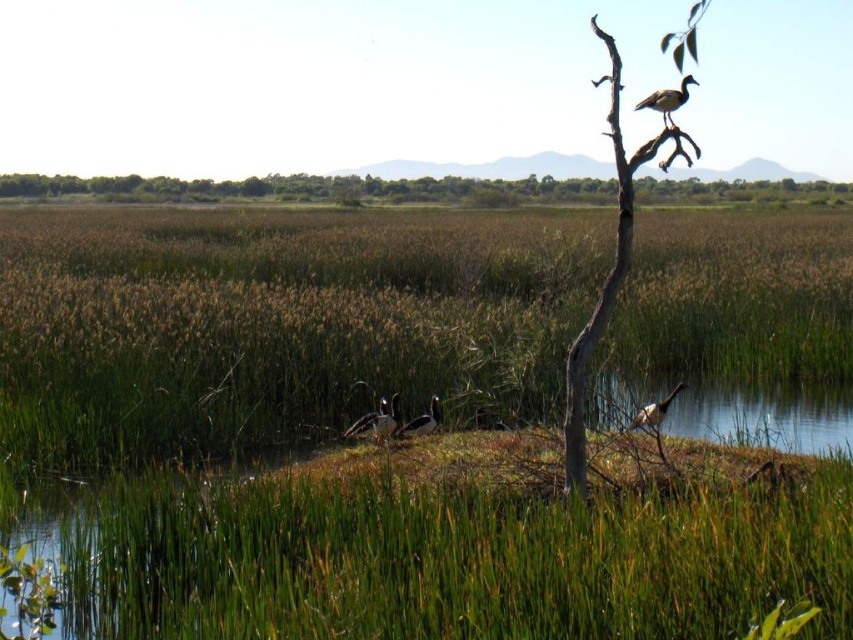
Consider the image. You are a drone operator trying to capture a photo of the green grassy mound at center. The drone is currently at position coordinates of point 0.7, 0.5. To ensure the mound is centered in the photo, should you move the drone north or south? Please provide your answer based on the 2D coordinates provided.

The green grassy mound at center is located at point (x=463, y=552). Since the drone is at (x=426, y=448), which is to the west and slightly south of the mound, you should move the drone east and slightly north to center the mound in the photo.

You are an ornithologist observing the wetland scene. You notice the brown wood tree at upper center and the brown speckled feathered bird at upper right. Which object occupies more horizontal space in the image?

The brown wood tree at upper center occupies more horizontal space than the brown speckled feathered bird at upper right because its width is larger.

You are a birdwatcher observing the scene from the lower left corner. You notice the brown wood tree at upper center and the brown speckled feathered bird at upper right. Which object is closer to your position?

The brown wood tree at upper center is closer to your position because it is in front of the brown speckled feathered bird at upper right.